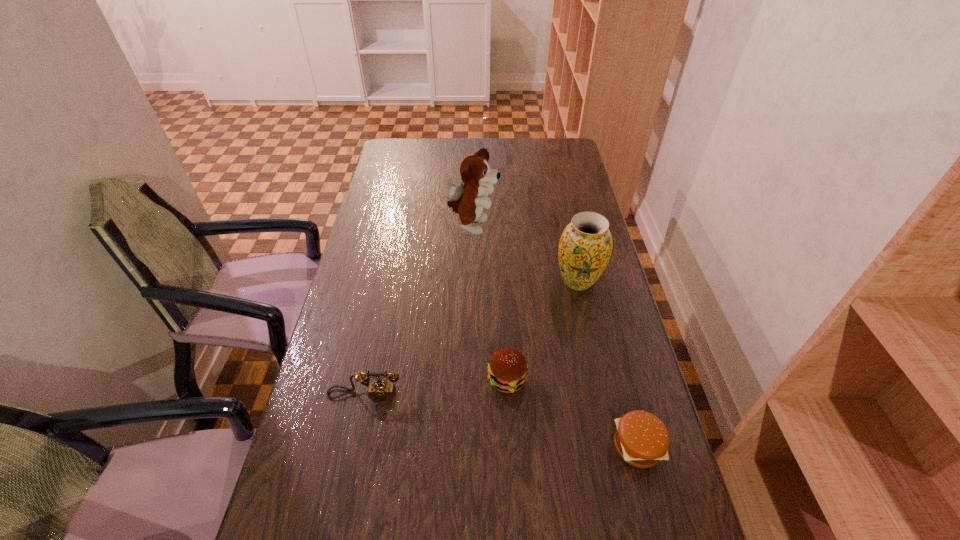
Identify the location of vacant space that satisfies the following two spatial constraints: 1. on the face of the tallest object; 2. on the right side of the second farthest object. (471, 281).

Find the location of a particular element. The width and height of the screenshot is (960, 540). vacant position in the image that satisfies the following two spatial constraints: 1. on the face of the farthest object; 2. on the right side of the farther hamburger is located at coordinates (469, 380).